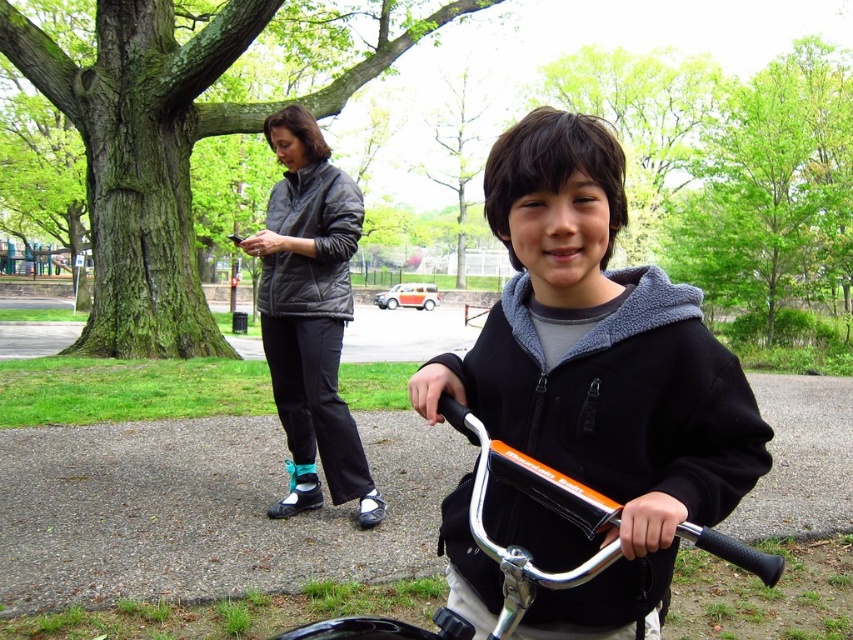
You are standing in the park and want to take a photo of the point at coordinates (299, 508). If your camera has a focal length of 50mm and you are 4.04 meters away from that point, what is the angle of view required to capture the entire scene around that point in your photo?

The angle of view required to capture the entire scene around the point at coordinates (299, 508) would depend on the camera sensor size and the desired field of view. However, with a focal length of 50mm and being 4.04 meters away, a standard angle of view should suffice for most typical park scenes.

You are standing at the park and see the matte black jacket at upper left. If you want to reach it within 5 seconds, what is the minimum speed you need to move towards it?

The matte black jacket at upper left is 3.53 meters away. To reach it in 5 seconds, you need to move at a minimum speed of 0.706 meters per second.